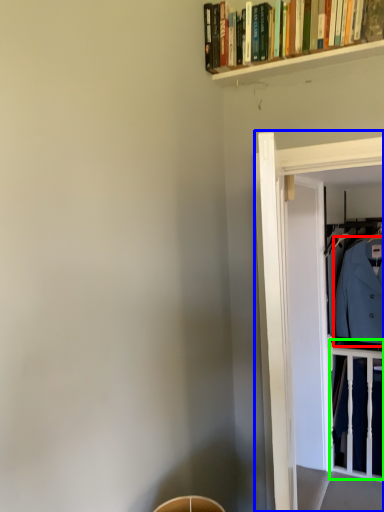
Question: Which object is positioned farthest from dress shirt (highlighted by a red box)? Select from glass door (highlighted by a blue box) and balustrade (highlighted by a green box).

Choices:
 (A) glass door
 (B) balustrade

Answer: (A)